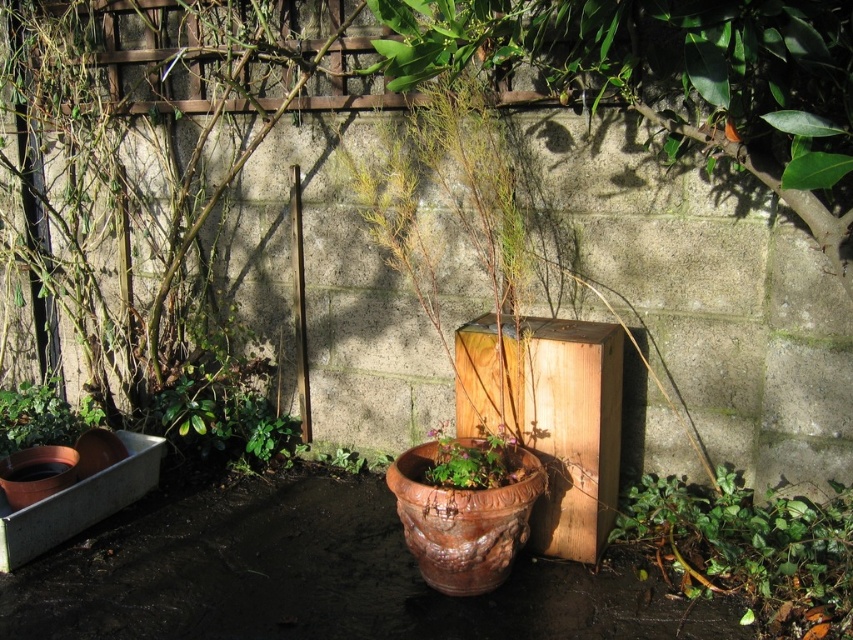
Between matte brown pot at lower left and terracotta pot at center, which one appears on the left side from the viewer's perspective?

Positioned to the left is matte brown pot at lower left.

Does matte brown pot at lower left have a lesser height compared to terracotta pot at center?

No, matte brown pot at lower left is not shorter than terracotta pot at center.

Image resolution: width=853 pixels, height=640 pixels. What do you see at coordinates (42, 417) in the screenshot? I see `matte brown pot at lower left` at bounding box center [42, 417].

Find the location of a particular element. matte brown pot at lower left is located at coordinates (x=42, y=417).

Between green leafy plant at lower right and terracotta pot at center, which one appears on the left side from the viewer's perspective?

terracotta pot at center is more to the left.

Between green leafy plant at lower right and terracotta pot at center, which one appears on the right side from the viewer's perspective?

green leafy plant at lower right

Does point (721, 480) come behind point (434, 480)?

Yes, it is behind point (434, 480).

Where is `green leafy plant at lower right`? green leafy plant at lower right is located at coordinates (750, 548).

Is green leafy plant at lower right behind matte brown pot at lower left?

No, it is not.

Is green leafy plant at lower right above matte brown pot at lower left?

Actually, green leafy plant at lower right is below matte brown pot at lower left.

Locate an element on the screen. green leafy plant at lower right is located at coordinates (750, 548).

Locate an element on the screen. green leafy plant at lower right is located at coordinates (750, 548).